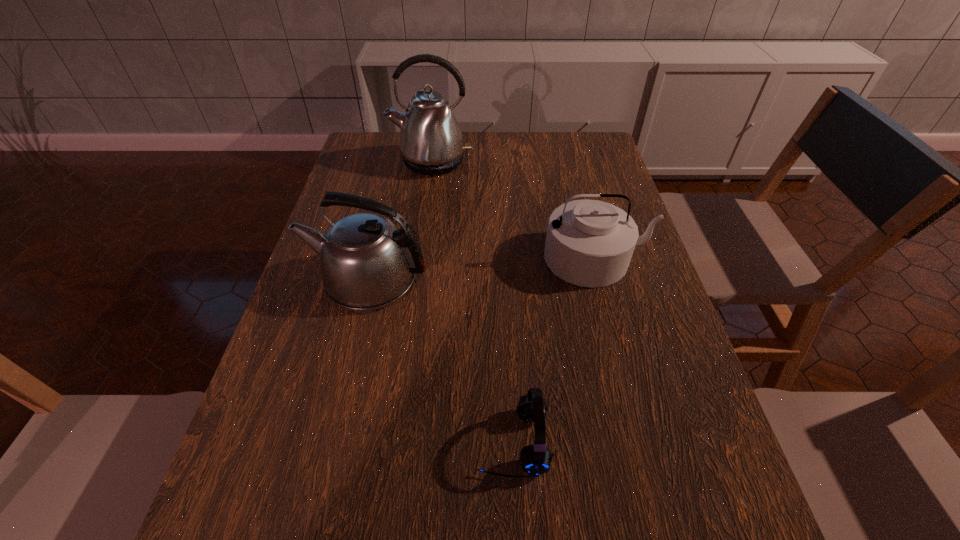
This screenshot has height=540, width=960. Find the location of `vacant area that lies between the farthest kettle and the nearest object`. vacant area that lies between the farthest kettle and the nearest object is located at coordinates (471, 302).

The width and height of the screenshot is (960, 540). What are the coordinates of `free space between the shortest kettle and the second shortest kettle` in the screenshot? It's located at (482, 268).

This screenshot has height=540, width=960. What are the coordinates of `free space between the shortest object and the shortest kettle` in the screenshot? It's located at (554, 350).

Image resolution: width=960 pixels, height=540 pixels. I want to click on free space that is in between the shortest kettle and the headset, so click(x=554, y=350).

You are a GUI agent. You are given a task and a screenshot of the screen. Output one action in this format:
    pyautogui.click(x=<x>, y=<y>)
    Task: Click on the free space between the shortest kettle and the third shortest object
    The height and width of the screenshot is (540, 960).
    Given the screenshot: What is the action you would take?
    pyautogui.click(x=482, y=268)

The image size is (960, 540). I want to click on blank region between the farthest object and the third tallest object, so click(x=514, y=210).

Where is `empty space between the shortest kettle and the third shortest object`? empty space between the shortest kettle and the third shortest object is located at coordinates (482, 268).

Identify the location of object that stands as the closest to the farthest kettle. This screenshot has height=540, width=960. (589, 243).

Identify which object is located as the second nearest to the tallest kettle. Please provide its 2D coordinates. Your answer should be formatted as a tuple, i.e. [(x, y)], where the tuple contains the x and y coordinates of a point satisfying the conditions above.

[(366, 262)]

I want to click on kettle that is the second closest one to the tallest kettle, so click(366, 262).